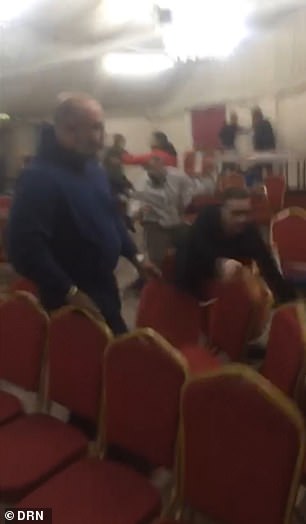
Identify the location of wall. (23, 138).